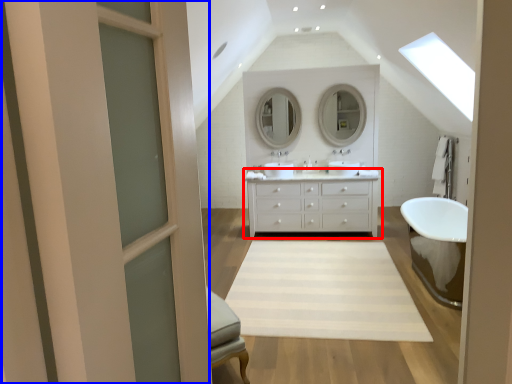
Question: Which of the following is the closest to the observer, bathroom cabinet (highlighted by a red box) or screen door (highlighted by a blue box)?

Choices:
 (A) bathroom cabinet
 (B) screen door

Answer: (B)